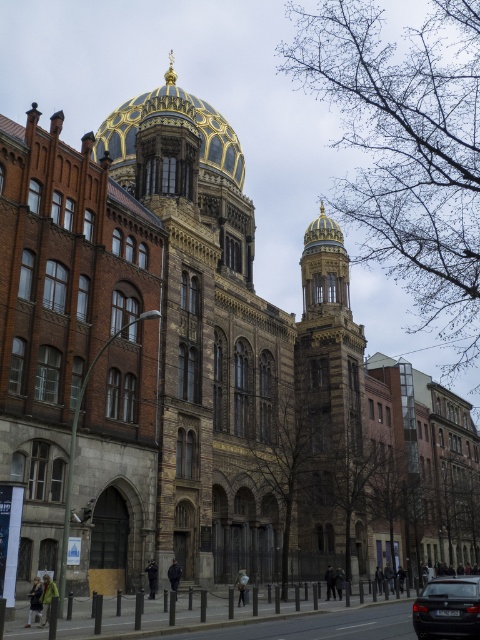
Looking at this image, you are standing in front of the grand architectural structure with the golden dome. You notice a black glossy car parked somewhere in the scene. Can you determine the exact location of the point at coordinates point [447,609] relative to the car?

The point at coordinates point [447,609] is located on the black glossy car at lower right.

You are an architect visiting this historical site and want to compare the height of the gold mosaic dome at upper center and the black glossy car at lower right. Which one is taller?

The gold mosaic dome at upper center has a greater height compared to the black glossy car at lower right, so the gold mosaic dome at upper center is taller.

Based on the photo, you are standing in front of the grand building and notice the gold mosaic dome at upper center and the black glossy car at lower right. Which object is positioned higher in the image?

The gold mosaic dome at upper center is located above the black glossy car at lower right, so it is positioned higher in the image.